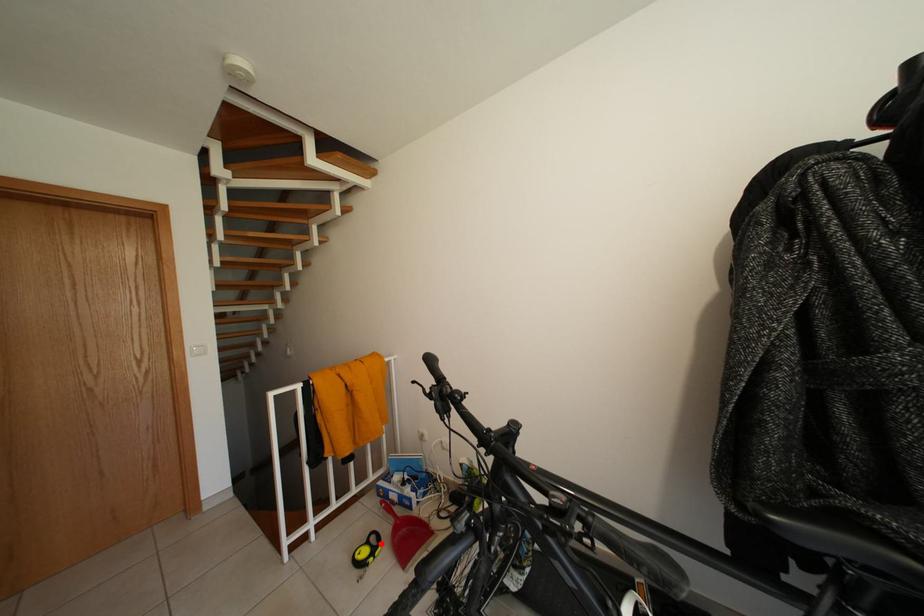
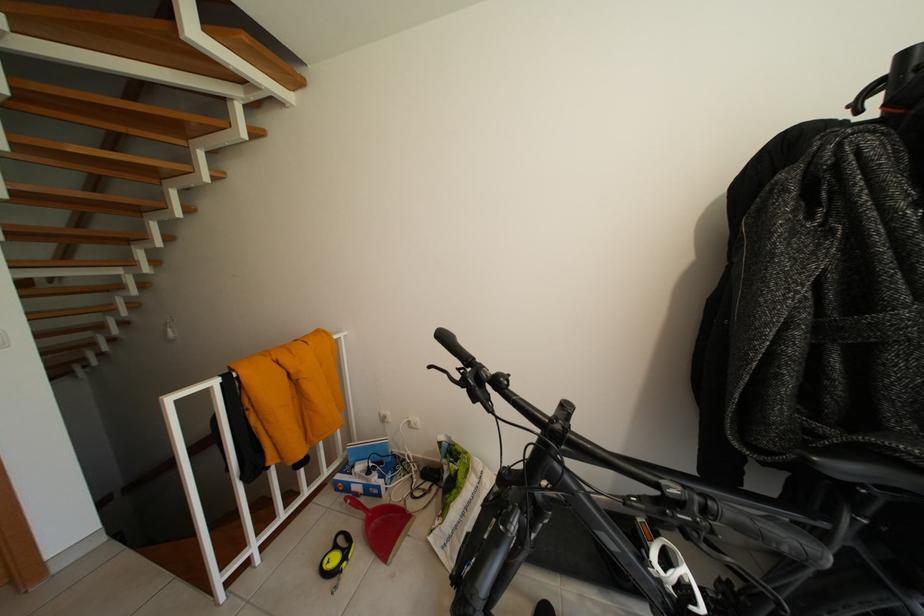
Locate, in the second image, the point that corresponds to the highlighted location in the first image.

(348, 545)